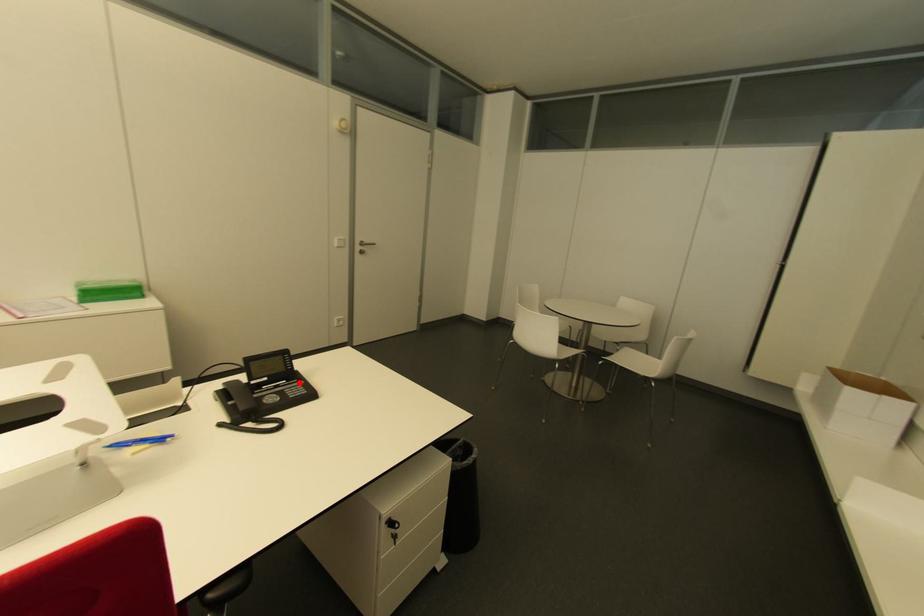
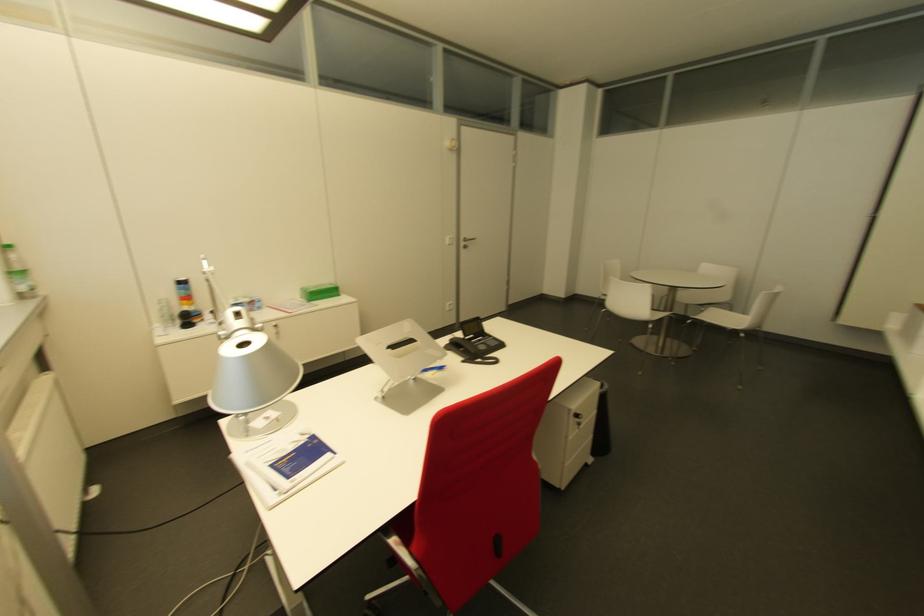
The point at the highlighted location is marked in the first image. Where is the corresponding point in the second image?

(490, 338)